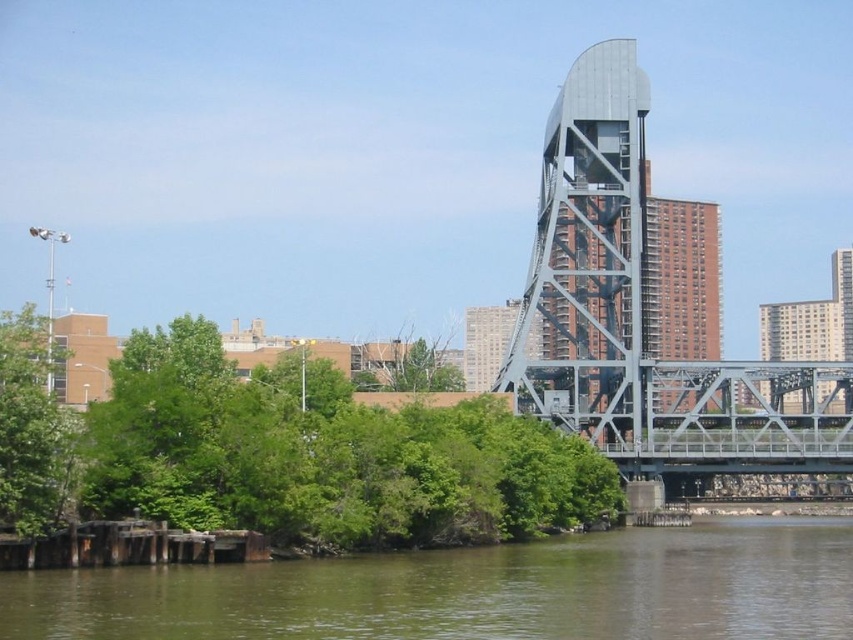
The height and width of the screenshot is (640, 853). What do you see at coordinates (281, 452) in the screenshot?
I see `green leafy tree at lower left` at bounding box center [281, 452].

Can you confirm if green leafy tree at lower left is taller than metallic gray bridge at center-right?

Yes.

You are a GUI agent. You are given a task and a screenshot of the screen. Output one action in this format:
    pyautogui.click(x=<x>, y=<y>)
    Task: Click on the green leafy tree at lower left
    
    Given the screenshot: What is the action you would take?
    pyautogui.click(x=281, y=452)

Between green water at lower center and metallic gray bridge at center-right, which one appears on the right side from the viewer's perspective?

From the viewer's perspective, metallic gray bridge at center-right appears more on the right side.

Is green water at lower center positioned in front of metallic gray bridge at center-right?

Yes, green water at lower center is closer to the viewer.

Where is `green water at lower center`? The height and width of the screenshot is (640, 853). green water at lower center is located at coordinates click(x=474, y=592).

Which is behind, point (593, 628) or point (59, 508)?

Positioned behind is point (59, 508).

Is point (0, 582) closer to viewer compared to point (10, 468)?

Yes, it is in front of point (10, 468).

This screenshot has width=853, height=640. I want to click on green water at lower center, so click(x=474, y=592).